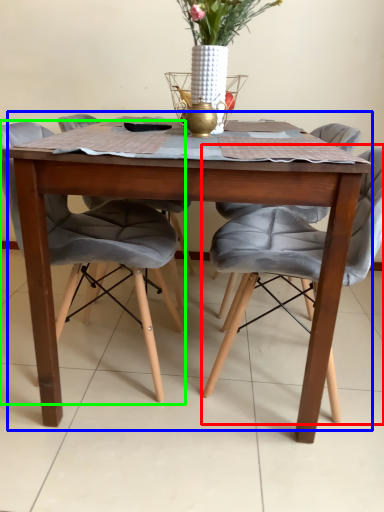
Question: Considering the real-world distances, which object is closest to chair (highlighted by a red box)? kitchen & dining room table (highlighted by a blue box) or chair (highlighted by a green box).

Choices:
 (A) kitchen & dining room table
 (B) chair

Answer: (A)